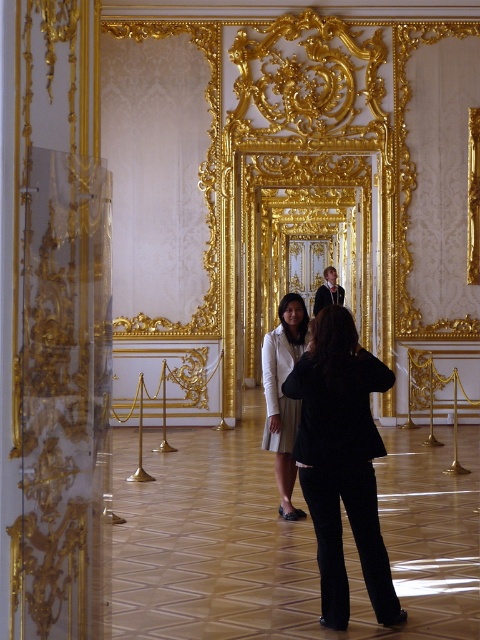
Question: Does light beige fabric dress at center appear over smooth black suit at center?

Choices:
 (A) no
 (B) yes

Answer: (A)

Question: Which point is farther to the camera?

Choices:
 (A) light beige fabric dress at center
 (B) smooth black suit at center

Answer: (B)

Question: Which of the following is the closest to the observer?

Choices:
 (A) (330, 292)
 (B) (290, 339)
 (C) (325, 497)

Answer: (C)

Question: Is black fabric coat at center above smooth black suit at center?

Choices:
 (A) yes
 (B) no

Answer: (B)

Question: Does black fabric coat at center have a lesser width compared to smooth black suit at center?

Choices:
 (A) yes
 (B) no

Answer: (B)

Question: Which point is closer to the camera?

Choices:
 (A) black fabric coat at center
 (B) smooth black suit at center
 (C) light beige fabric dress at center

Answer: (A)